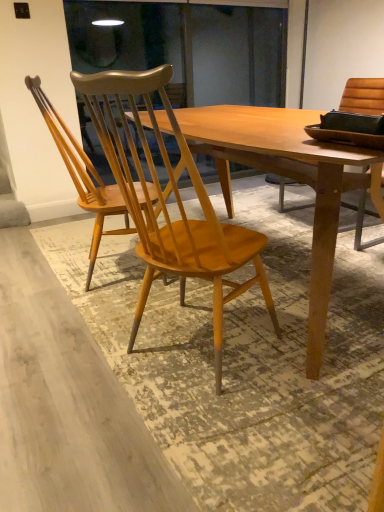
Question: Is light brown wood chair at center, which is counted as the second chair, starting from the right, situated inside light brown wood chair at center, the 1th chair viewed from the right, or outside?

Choices:
 (A) outside
 (B) inside

Answer: (A)

Question: Considering the positions of light brown wood chair at center, which ranks as the first chair in left-to-right order, and light brown wood chair at center, the 2th chair when ordered from left to right, in the image, is light brown wood chair at center, which ranks as the first chair in left-to-right order, taller or shorter than light brown wood chair at center, the 2th chair when ordered from left to right,?

Choices:
 (A) short
 (B) tall

Answer: (A)

Question: Looking at their shapes, would you say light brown wood chair at center, which ranks as the first chair in left-to-right order, is wider or thinner than light brown wood chair at center, the 2th chair when ordered from left to right?

Choices:
 (A) thin
 (B) wide

Answer: (A)

Question: From a real-world perspective, relative to light brown wood chair at center, which ranks as the first chair in left-to-right order, is light brown wood chair at center, the 2th chair when ordered from left to right, vertically above or below?

Choices:
 (A) above
 (B) below

Answer: (B)

Question: Does point (183, 157) appear closer or farther from the camera than point (140, 187)?

Choices:
 (A) closer
 (B) farther

Answer: (A)

Question: Considering the relative positions of light brown wood chair at center, the 1th chair viewed from the right, and light brown wood chair at center, which is counted as the second chair, starting from the right, in the image provided, is light brown wood chair at center, the 1th chair viewed from the right, to the left or to the right of light brown wood chair at center, which is counted as the second chair, starting from the right,?

Choices:
 (A) right
 (B) left

Answer: (A)

Question: Is light brown wood chair at center, the 2th chair when ordered from left to right, inside or outside of light brown wood chair at center, which is counted as the second chair, starting from the right?

Choices:
 (A) outside
 (B) inside

Answer: (A)